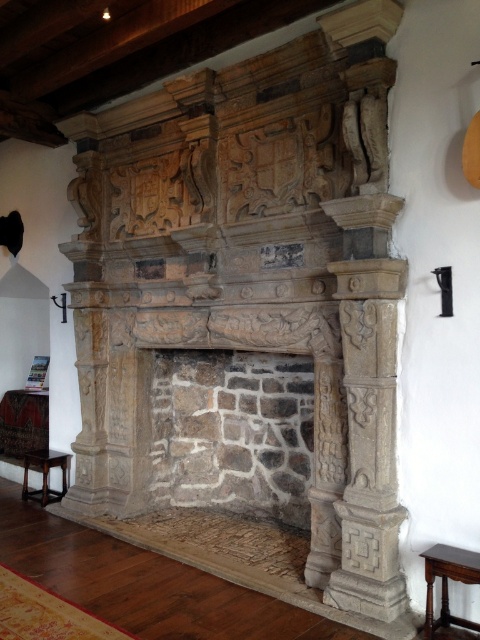
Question: Does stone fireplace at center have a larger size compared to wooden stool at lower right?

Choices:
 (A) yes
 (B) no

Answer: (A)

Question: Does stone fireplace at center have a greater width compared to wooden stool at lower right?

Choices:
 (A) no
 (B) yes

Answer: (B)

Question: Which of the following is the closest to the observer?

Choices:
 (A) (48, 472)
 (B) (238, 346)

Answer: (B)

Question: Which of the following is the farthest from the observer?

Choices:
 (A) (156, 241)
 (B) (60, 461)
 (C) (441, 547)

Answer: (B)

Question: Can you confirm if stone fireplace at center is bigger than wooden stool at lower right?

Choices:
 (A) no
 (B) yes

Answer: (B)

Question: Which object is the closest to the wooden stool at lower right?

Choices:
 (A) dark brown wood stool at lower left
 (B) stone fireplace at center

Answer: (B)